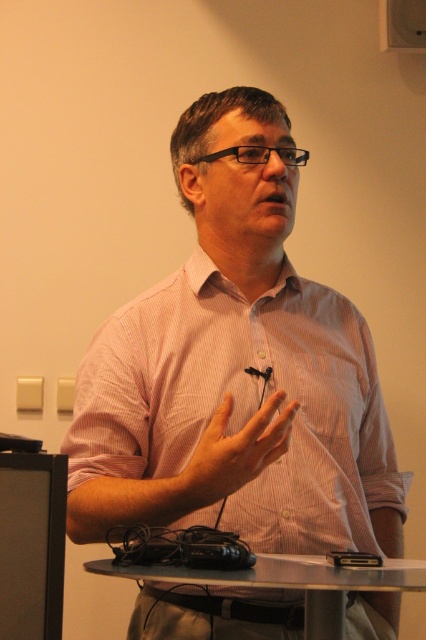
You are a robot assistant positioned at the center of the image. You need to locate the black glossy monitor at lower left. What are its coordinates?

The coordinates of the black glossy monitor at lower left are at point (31,545).

What is the exact position of the pink striped shirt at center in the image?

The pink striped shirt at center is located at point coordinates of (236,371).